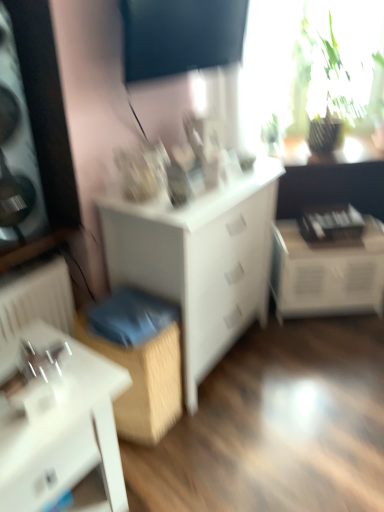
Question: Is white glossy table at lower right, which is the 1th table in back-to-front order, positioned before dark matte screen at upper center, which appears as the first window screen when viewed from the front?

Choices:
 (A) no
 (B) yes

Answer: (A)

Question: Is white glossy table at lower right, which is the 1th table in back-to-front order, not near dark matte screen at upper center, which appears as the first window screen when viewed from the front?

Choices:
 (A) yes
 (B) no

Answer: (A)

Question: From a real-world perspective, is white glossy table at lower right, placed as the 2th table when sorted from bottom to top, positioned over dark matte screen at upper center, the 2th window screen positioned from the right, based on gravity?

Choices:
 (A) yes
 (B) no

Answer: (B)

Question: Is white glossy table at lower right, the first table from the right, turned away from dark matte screen at upper center, which ranks as the second window screen in back-to-front order?

Choices:
 (A) no
 (B) yes

Answer: (A)

Question: Does white glossy table at lower right, the first table from the right, have a larger size compared to dark matte screen at upper center, which ranks as the second window screen in back-to-front order?

Choices:
 (A) yes
 (B) no

Answer: (A)

Question: Does white glossy table at lower right, which is the 1th table in back-to-front order, have a lesser height compared to dark matte screen at upper center, which appears as the first window screen when viewed from the front?

Choices:
 (A) no
 (B) yes

Answer: (A)

Question: Does dark matte screen at upper center, the 2th window screen positioned from the right, have a lesser width compared to white glossy table at lower left, the 1th table from the bottom?

Choices:
 (A) no
 (B) yes

Answer: (B)

Question: From a real-world perspective, is dark matte screen at upper center, the 2th window screen positioned from the right, on top of white glossy table at lower left, the 2th table in the top-to-bottom sequence?

Choices:
 (A) no
 (B) yes

Answer: (B)

Question: Can you confirm if dark matte screen at upper center, which ranks as the second window screen in back-to-front order, is wider than white glossy table at lower left, the 2th table in the top-to-bottom sequence?

Choices:
 (A) yes
 (B) no

Answer: (B)

Question: From a real-world perspective, is dark matte screen at upper center, which appears as the first window screen when viewed from the front, located beneath white glossy table at lower left, the 2th table in the top-to-bottom sequence?

Choices:
 (A) no
 (B) yes

Answer: (A)

Question: Considering the relative sizes of dark matte screen at upper center, which appears as the first window screen when viewed from the front, and white glossy table at lower left, the second table from the right, in the image provided, is dark matte screen at upper center, which appears as the first window screen when viewed from the front, smaller than white glossy table at lower left, the second table from the right,?

Choices:
 (A) no
 (B) yes

Answer: (B)

Question: Is dark matte screen at upper center, which ranks as the second window screen in back-to-front order, closer to camera compared to white glossy table at lower left, which ranks as the 1th table in front-to-back order?

Choices:
 (A) yes
 (B) no

Answer: (B)

Question: Is dark matte screen at upper center, placed as the first window screen when sorted from left to right, facing towards wooden box at lower center?

Choices:
 (A) yes
 (B) no

Answer: (B)